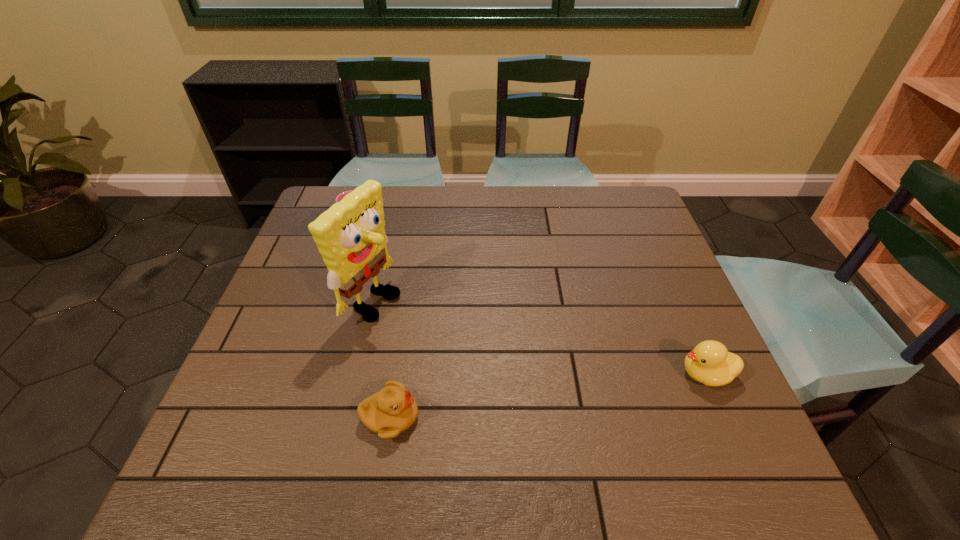
Locate an element on the screen. This screenshot has width=960, height=540. the left duckling is located at coordinates (391, 411).

You are a GUI agent. You are given a task and a screenshot of the screen. Output one action in this format:
    pyautogui.click(x=<x>, y=<y>)
    Task: Click on the right duckling
    This screenshot has height=540, width=960.
    Given the screenshot: What is the action you would take?
    pyautogui.click(x=710, y=363)

Where is `the tallest object`? the tallest object is located at coordinates (350, 236).

Find the location of a particular element. sponge is located at coordinates (350, 236).

You are a GUI agent. You are given a task and a screenshot of the screen. Output one action in this format:
    pyautogui.click(x=<x>, y=<y>)
    Task: Click on the shortest object
    Image resolution: width=960 pixels, height=540 pixels.
    Given the screenshot: What is the action you would take?
    pyautogui.click(x=342, y=195)

In order to click on the farthest object in this screenshot , I will do `click(342, 195)`.

This screenshot has height=540, width=960. I want to click on vacant region located at the beak of the left duckling, so click(478, 417).

You are a GUI agent. You are given a task and a screenshot of the screen. Output one action in this format:
    pyautogui.click(x=<x>, y=<y>)
    Task: Click on the free space located on the beak of the right duckling
    The height and width of the screenshot is (540, 960).
    Given the screenshot: What is the action you would take?
    pyautogui.click(x=564, y=374)

What are the coordinates of `vacant space situated 0.320m on the beak of the right duckling` in the screenshot? It's located at (532, 374).

Identify the location of free space located on the beak of the right duckling. (564, 374).